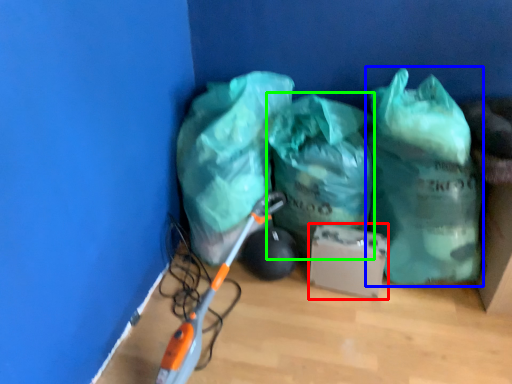
Question: Estimate the real-world distances between objects in this image. Which object is farther from cardboard box (highlighted by a red box), plastic bag (highlighted by a blue box) or plastic bag (highlighted by a green box)?

Choices:
 (A) plastic bag
 (B) plastic bag

Answer: (A)